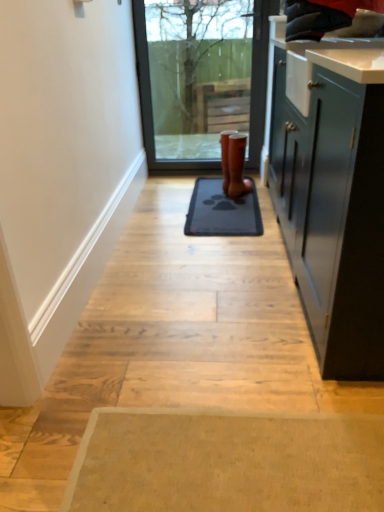
Question: Is gray rubber mat at center further to camera compared to transparent glass door at center?

Choices:
 (A) yes
 (B) no

Answer: (B)

Question: Is gray rubber mat at center at the left side of transparent glass door at center?

Choices:
 (A) no
 (B) yes

Answer: (A)

Question: From the image's perspective, is gray rubber mat at center below transparent glass door at center?

Choices:
 (A) yes
 (B) no

Answer: (A)

Question: Is gray rubber mat at center in front of transparent glass door at center?

Choices:
 (A) no
 (B) yes

Answer: (B)

Question: From a real-world perspective, does gray rubber mat at center stand above transparent glass door at center?

Choices:
 (A) no
 (B) yes

Answer: (A)

Question: Considering the relative sizes of gray rubber mat at center and transparent glass door at center in the image provided, is gray rubber mat at center shorter than transparent glass door at center?

Choices:
 (A) yes
 (B) no

Answer: (A)

Question: Considering the relative sizes of transparent glass door at center and gray rubber mat at center in the image provided, is transparent glass door at center shorter than gray rubber mat at center?

Choices:
 (A) yes
 (B) no

Answer: (B)

Question: Considering the relative positions of transparent glass door at center and gray rubber mat at center in the image provided, is transparent glass door at center to the left of gray rubber mat at center from the viewer's perspective?

Choices:
 (A) yes
 (B) no

Answer: (A)

Question: From the image's perspective, is transparent glass door at center below gray rubber mat at center?

Choices:
 (A) no
 (B) yes

Answer: (A)

Question: Is transparent glass door at center in front of gray rubber mat at center?

Choices:
 (A) yes
 (B) no

Answer: (B)

Question: Can you confirm if transparent glass door at center is taller than gray rubber mat at center?

Choices:
 (A) no
 (B) yes

Answer: (B)

Question: Can you confirm if transparent glass door at center is thinner than gray rubber mat at center?

Choices:
 (A) no
 (B) yes

Answer: (B)

Question: Is gray rubber mat at center beside brown leather boot at center?

Choices:
 (A) no
 (B) yes

Answer: (A)